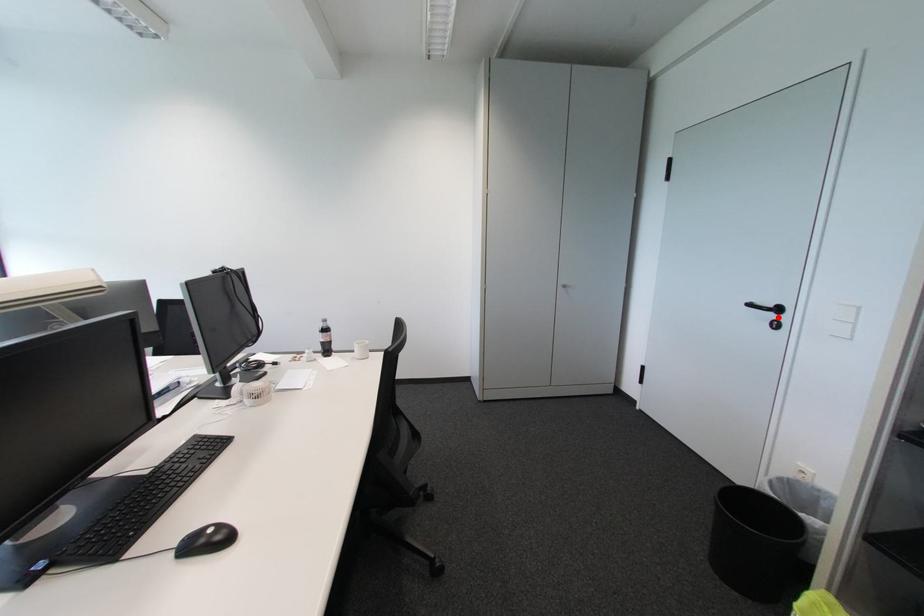
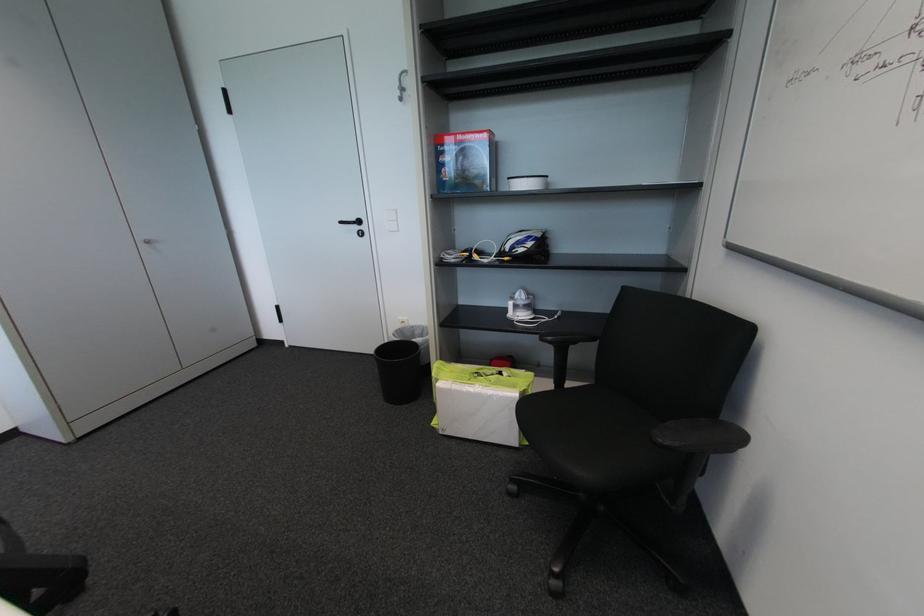
Where in the second image is the point corresponding to the highlighted location from the first image?

(362, 229)